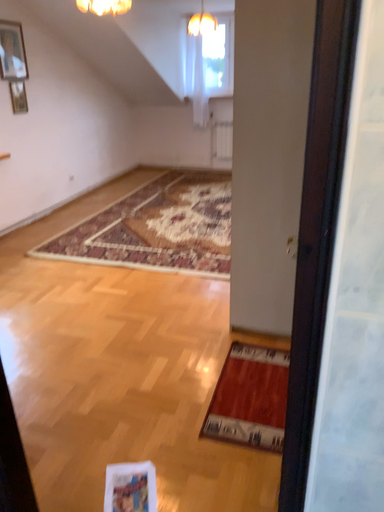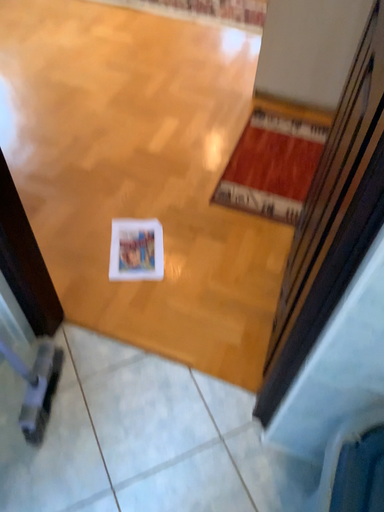
Question: How did the camera likely rotate when shooting the video?

Choices:
 (A) rotated downward
 (B) rotated upward

Answer: (A)